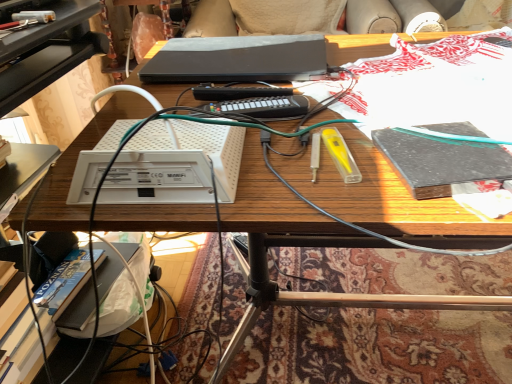
The height and width of the screenshot is (384, 512). I want to click on vacant space in front of black matte laptop at center, so click(x=300, y=115).